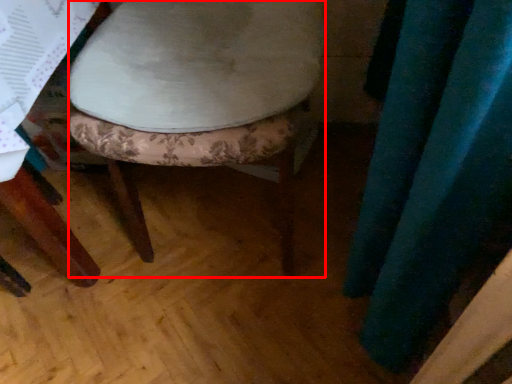
Question: Observing the image, what is the correct spatial positioning of stool (annotated by the red box) in reference to curtain?

Choices:
 (A) left
 (B) right

Answer: (A)